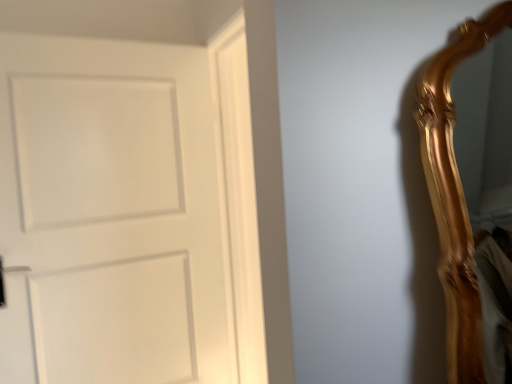
What do you see at coordinates (116, 210) in the screenshot?
I see `white matte door at left` at bounding box center [116, 210].

Find the location of a particular element. The image size is (512, 384). white matte door at left is located at coordinates (116, 210).

At what (x,y) coordinates should I click in order to perform the action: click on white matte door at left. Please return your answer as a coordinate pair (x, y). This screenshot has width=512, height=384. Looking at the image, I should click on (116, 210).